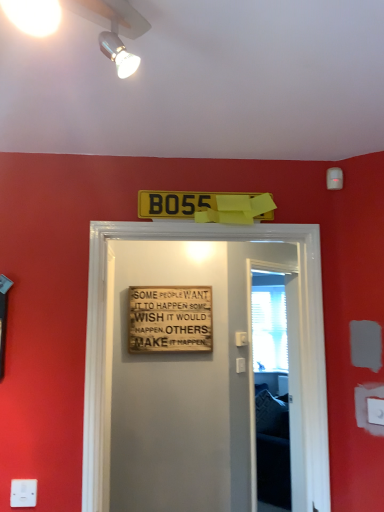
Question: Should I look upward or downward to see white glossy spotlight at upper center?

Choices:
 (A) up
 (B) down

Answer: (A)

Question: Does yellow plastic license plate at center, the 2th warning sign in the bottom-to-top sequence, come in front of white plastic electric outlet at lower right, the 1th electric outlet positioned from the back?

Choices:
 (A) yes
 (B) no

Answer: (B)

Question: Considering the relative sizes of yellow plastic license plate at center, the 2th warning sign in the bottom-to-top sequence, and white plastic electric outlet at lower right, which is the 2th electric outlet in left-to-right order, in the image provided, is yellow plastic license plate at center, the 2th warning sign in the bottom-to-top sequence, wider than white plastic electric outlet at lower right, which is the 2th electric outlet in left-to-right order,?

Choices:
 (A) no
 (B) yes

Answer: (B)

Question: Considering the relative positions of yellow plastic license plate at center, positioned as the 2th warning sign in back-to-front order, and white plastic electric outlet at lower right, which is the second electric outlet in bottom-to-top order, in the image provided, is yellow plastic license plate at center, positioned as the 2th warning sign in back-to-front order, to the right of white plastic electric outlet at lower right, which is the second electric outlet in bottom-to-top order, from the viewer's perspective?

Choices:
 (A) yes
 (B) no

Answer: (B)

Question: Considering the relative sizes of yellow plastic license plate at center, positioned as the 2th warning sign in back-to-front order, and white plastic electric outlet at lower right, which is the 2th electric outlet in left-to-right order, in the image provided, is yellow plastic license plate at center, positioned as the 2th warning sign in back-to-front order, shorter than white plastic electric outlet at lower right, which is the 2th electric outlet in left-to-right order,?

Choices:
 (A) no
 (B) yes

Answer: (A)

Question: Considering the relative positions of yellow plastic license plate at center, which appears as the 1th warning sign when viewed from the front, and white plastic electric outlet at lower right, which is the second electric outlet in bottom-to-top order, in the image provided, is yellow plastic license plate at center, which appears as the 1th warning sign when viewed from the front, behind white plastic electric outlet at lower right, which is the second electric outlet in bottom-to-top order,?

Choices:
 (A) no
 (B) yes

Answer: (B)

Question: Can you confirm if yellow plastic license plate at center, which appears as the 1th warning sign when viewed from the front, is taller than white plastic electric outlet at lower right, the 1th electric outlet viewed from the right?

Choices:
 (A) no
 (B) yes

Answer: (B)

Question: Considering the relative sizes of white plastic electric outlet at lower left, the 1th electric outlet in the left-to-right sequence, and white mesh screen at right in the image provided, is white plastic electric outlet at lower left, the 1th electric outlet in the left-to-right sequence, thinner than white mesh screen at right?

Choices:
 (A) no
 (B) yes

Answer: (A)

Question: Is white plastic electric outlet at lower left, placed as the 2th electric outlet when sorted from right to left, aimed at white mesh screen at right?

Choices:
 (A) yes
 (B) no

Answer: (B)

Question: Is white plastic electric outlet at lower left, which appears as the 2th electric outlet when viewed from the top, bigger than white mesh screen at right?

Choices:
 (A) no
 (B) yes

Answer: (A)

Question: Is white plastic electric outlet at lower left, marked as the 2th electric outlet in a back-to-front arrangement, surrounding white mesh screen at right?

Choices:
 (A) no
 (B) yes

Answer: (A)

Question: Does white plastic electric outlet at lower left, the first electric outlet positioned from the front, have a greater height compared to white mesh screen at right?

Choices:
 (A) no
 (B) yes

Answer: (A)

Question: From the image's perspective, is white plastic electric outlet at lower left, which appears as the 2th electric outlet when viewed from the top, on top of white mesh screen at right?

Choices:
 (A) yes
 (B) no

Answer: (A)

Question: Can you confirm if yellow plastic license plate at center, which appears as the 1th warning sign when viewed from the front, is wider than wooden signboard at center?

Choices:
 (A) yes
 (B) no

Answer: (B)